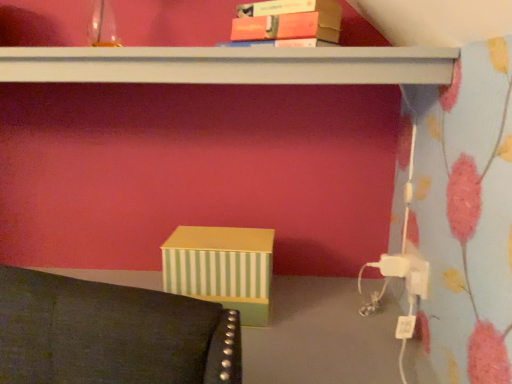
Question: Could you tell me if white plastic plug at lower right is facing white matte shelf at upper center?

Choices:
 (A) yes
 (B) no

Answer: (B)

Question: Is white plastic plug at lower right to the left of white matte shelf at upper center from the viewer's perspective?

Choices:
 (A) no
 (B) yes

Answer: (A)

Question: From the image's perspective, does white plastic plug at lower right appear higher than white matte shelf at upper center?

Choices:
 (A) yes
 (B) no

Answer: (B)

Question: From a real-world perspective, is white plastic plug at lower right on white matte shelf at upper center?

Choices:
 (A) no
 (B) yes

Answer: (A)

Question: Is white plastic plug at lower right wider than white matte shelf at upper center?

Choices:
 (A) no
 (B) yes

Answer: (A)

Question: Would you say white matte shelf at upper center is to the left or to the right of white plastic plug at lower right in the picture?

Choices:
 (A) right
 (B) left

Answer: (B)

Question: Considering the positions of white matte shelf at upper center and white plastic plug at lower right in the image, is white matte shelf at upper center bigger or smaller than white plastic plug at lower right?

Choices:
 (A) small
 (B) big

Answer: (B)

Question: In terms of height, does white matte shelf at upper center look taller or shorter compared to white plastic plug at lower right?

Choices:
 (A) tall
 (B) short

Answer: (A)

Question: Is point (436, 61) positioned closer to the camera than point (395, 254)?

Choices:
 (A) closer
 (B) farther

Answer: (A)

Question: Looking at their shapes, would you say white plastic plug at lower right is wider or thinner than matte orange book at upper center?

Choices:
 (A) wide
 (B) thin

Answer: (B)

Question: In terms of size, does white plastic plug at lower right appear bigger or smaller than matte orange book at upper center?

Choices:
 (A) small
 (B) big

Answer: (A)

Question: In the image, is white plastic plug at lower right positioned in front of or behind matte orange book at upper center?

Choices:
 (A) front
 (B) behind

Answer: (B)

Question: From a real-world perspective, is white plastic plug at lower right positioned above or below matte orange book at upper center?

Choices:
 (A) above
 (B) below

Answer: (B)

Question: Is matte orange book at upper center taller or shorter than white matte shelf at upper center?

Choices:
 (A) short
 (B) tall

Answer: (B)

Question: From a real-world perspective, is matte orange book at upper center physically located above or below white matte shelf at upper center?

Choices:
 (A) below
 (B) above

Answer: (B)